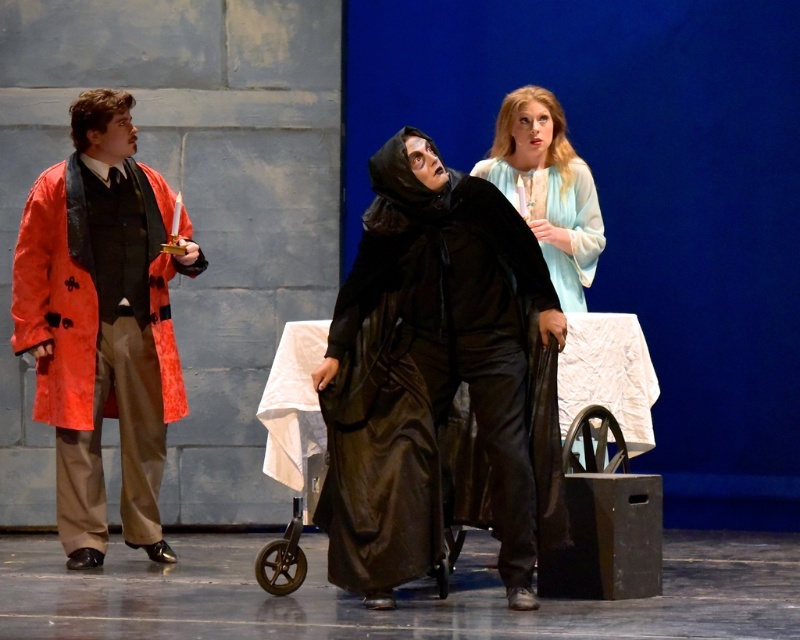
Does point (160, 182) come in front of point (532, 198)?

No, (160, 182) is behind (532, 198).

Find the location of a particular element. The width and height of the screenshot is (800, 640). shiny red coat at left is located at coordinates (102, 323).

Who is more forward, (390, 401) or (66, 296)?

Positioned in front is point (390, 401).

Who is higher up, velvet black robe at center or shiny red coat at left?

Positioned higher is shiny red coat at left.

Which is in front, point (494, 253) or point (134, 211)?

Point (494, 253) is more forward.

This screenshot has width=800, height=640. Find the location of `velvet black robe at center`. velvet black robe at center is located at coordinates (429, 371).

Is point (496, 321) less distant than point (513, 134)?

Yes, it is.

Does velvet black robe at center have a lesser height compared to light blue silk dress at center?

In fact, velvet black robe at center may be taller than light blue silk dress at center.

Where is `velvet black robe at center`? The width and height of the screenshot is (800, 640). velvet black robe at center is located at coordinates tap(429, 371).

You are a GUI agent. You are given a task and a screenshot of the screen. Output one action in this format:
    pyautogui.click(x=<x>, y=<y>)
    Task: Click on the velvet black robe at center
    This screenshot has height=640, width=800.
    Given the screenshot: What is the action you would take?
    pyautogui.click(x=429, y=371)